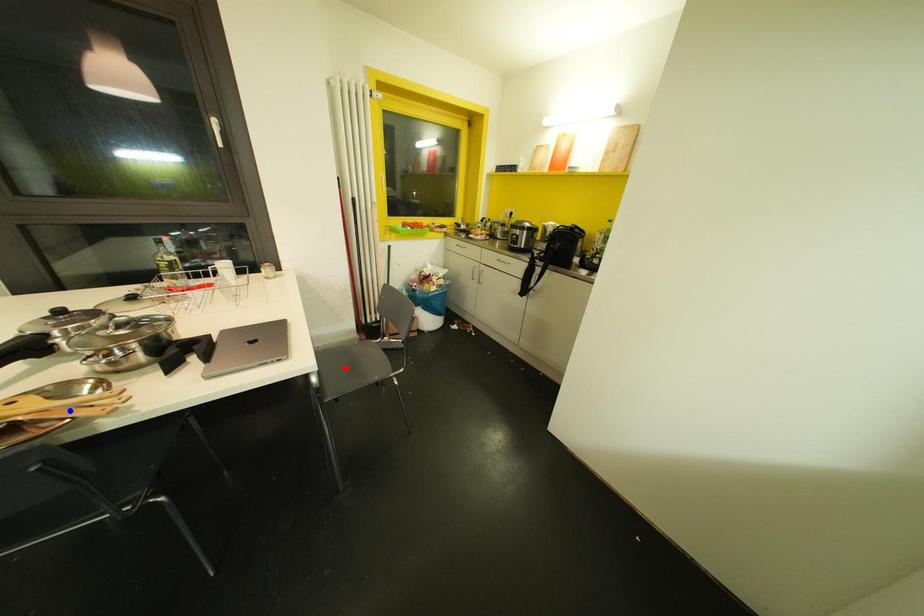
Question: In the image, two points are highlighted. Which point is nearer to the camera? Reply with the corresponding letter.

Choices:
 (A) blue point
 (B) red point

Answer: (A)